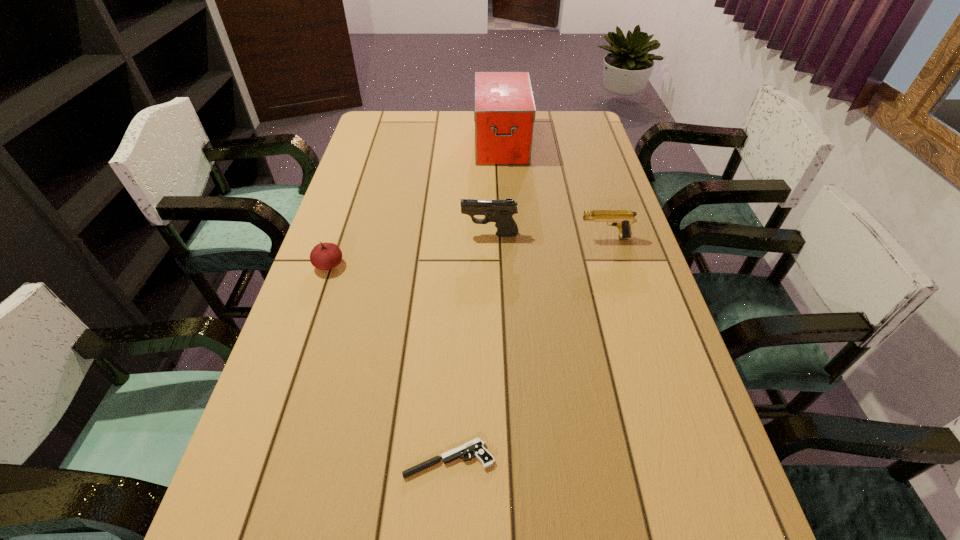
This screenshot has width=960, height=540. Identify the location of vacant space located at the barrel of the tallest pistol. (377, 235).

Where is `vacant region located at the barrel of the tallest pistol`? Image resolution: width=960 pixels, height=540 pixels. vacant region located at the barrel of the tallest pistol is located at coordinates (335, 235).

The image size is (960, 540). In order to click on free space located 0.260m at the barrel of the tallest pistol in this screenshot , I will do `click(371, 235)`.

Locate an element on the screen. This screenshot has height=540, width=960. vacant space located at the barrel of the third tallest object is located at coordinates (522, 238).

This screenshot has width=960, height=540. I want to click on free space located 0.100m at the barrel of the third tallest object, so click(x=543, y=238).

Locate an element on the screen. vacant region located at the barrel of the third tallest object is located at coordinates (526, 238).

Locate an element on the screen. Image resolution: width=960 pixels, height=540 pixels. free spot located on the front of the second shortest object is located at coordinates (291, 378).

You are a GUI agent. You are given a task and a screenshot of the screen. Output one action in this format:
    pyautogui.click(x=<x>, y=<y>)
    Task: Click on the vacant space positioned on the front-facing side of the shortest pistol
    This screenshot has height=540, width=960.
    Given the screenshot: What is the action you would take?
    pyautogui.click(x=350, y=459)

Locate an element on the screen. vacant point located on the front-facing side of the shortest pistol is located at coordinates (328, 459).

Find the location of a particular element. vacant position located 0.220m on the front-facing side of the shortest pistol is located at coordinates (x=285, y=459).